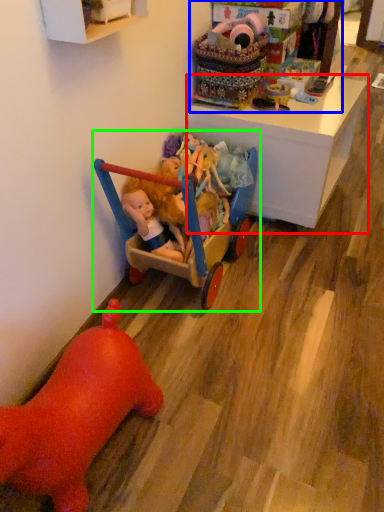
Question: Considering the real-world distances, which object is farthest from desk (highlighted by a red box)? toyshop (highlighted by a blue box) or toy (highlighted by a green box)?

Choices:
 (A) toyshop
 (B) toy

Answer: (B)